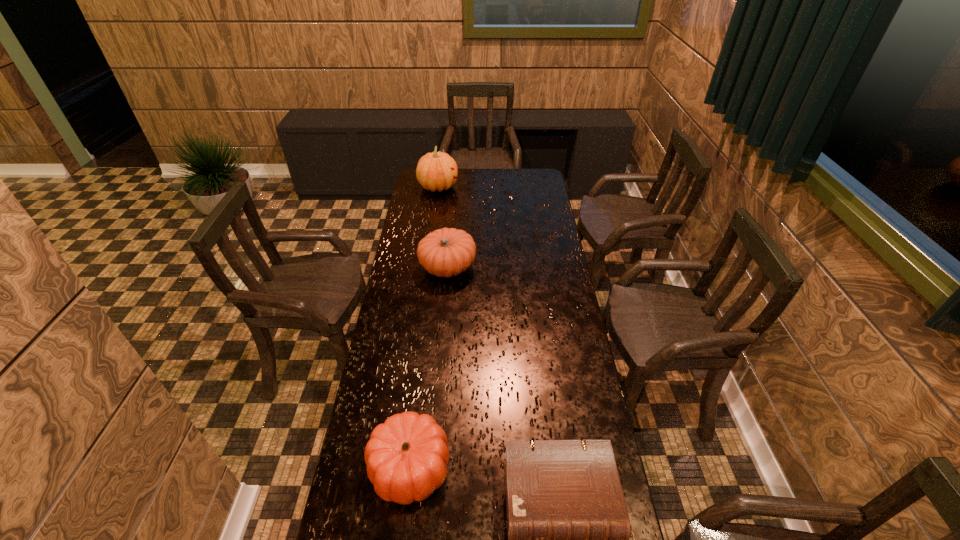
You are a GUI agent. You are given a task and a screenshot of the screen. Output one action in this format:
    pyautogui.click(x=<x>, y=<y>)
    Task: Click on the tallest pumpkin
    
    Given the screenshot: What is the action you would take?
    pyautogui.click(x=435, y=171)

Find the location of `the tallest object`. the tallest object is located at coordinates (435, 171).

Locate an element on the screen. This screenshot has width=960, height=540. the second farthest object is located at coordinates (447, 252).

The height and width of the screenshot is (540, 960). I want to click on the nearest pumpkin, so click(x=407, y=455).

You are a GUI agent. You are given a task and a screenshot of the screen. Output one action in this format:
    pyautogui.click(x=<x>, y=<y>)
    Task: Click on the vacant space situated 0.200m on the carved face of the farthest pumpkin
    The height and width of the screenshot is (540, 960).
    Given the screenshot: What is the action you would take?
    click(493, 187)

This screenshot has height=540, width=960. Find the location of `free region located on the back of the second nearest pumpkin`. free region located on the back of the second nearest pumpkin is located at coordinates (449, 244).

Where is `free spot located on the back of the nearest pumpkin`? This screenshot has width=960, height=540. free spot located on the back of the nearest pumpkin is located at coordinates (419, 392).

The image size is (960, 540). Identify the location of object located in the far edge section of the desktop. tap(435, 171).

You are a GUI agent. You are given a task and a screenshot of the screen. Output one action in this format:
    pyautogui.click(x=<x>, y=<y>)
    Task: Click on the object that is at the far left corner
    The image size is (960, 540).
    Given the screenshot: What is the action you would take?
    [x=435, y=171]

Identify the location of blank space at the far edge of the desktop. This screenshot has width=960, height=540. (458, 187).